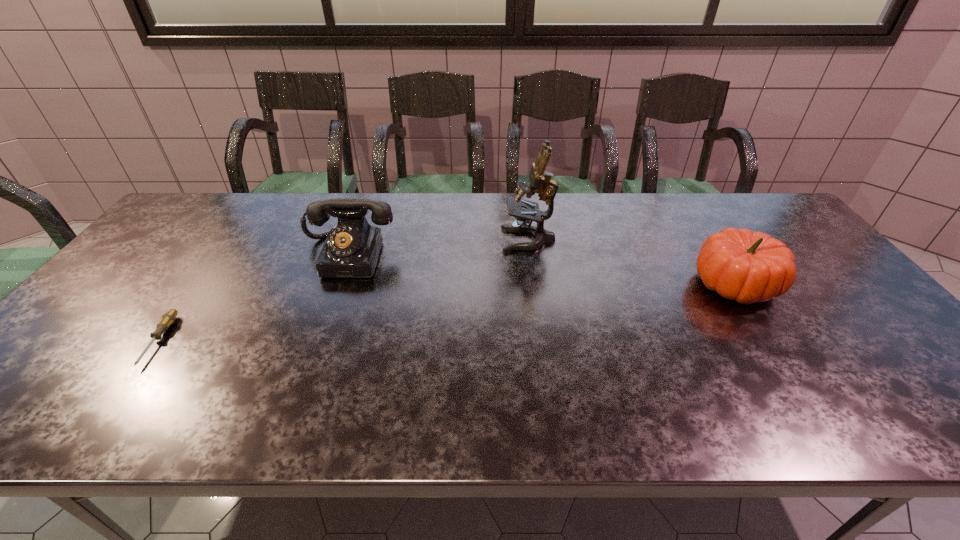
The image size is (960, 540). Identify the location of vacant space located on the left of the rightmost object. (623, 284).

This screenshot has height=540, width=960. Identify the location of free space located 0.140m at the tip of the shortest object. (97, 427).

The width and height of the screenshot is (960, 540). Identify the location of object present at the far edge. (541, 182).

This screenshot has width=960, height=540. In the image, there is a desktop. In order to click on vacant space at the far edge in this screenshot , I will do `click(468, 211)`.

In the image, there is a desktop. At what (x,y) coordinates should I click in order to perform the action: click on vacant space at the near edge. Please return your answer as a coordinate pair (x, y). Looking at the image, I should click on (871, 402).

Image resolution: width=960 pixels, height=540 pixels. In the image, there is a desktop. Identify the location of vacant region at the left edge. (84, 386).

The height and width of the screenshot is (540, 960). In the image, there is a desktop. What are the coordinates of `vacant space at the right edge` in the screenshot? It's located at (835, 283).

Identify the location of vacant space at the far left corner of the desktop. (222, 208).

I want to click on free location at the far right corner of the desktop, so click(x=723, y=201).

Find the location of a particular element. This screenshot has height=540, width=960. vacant space in between the tallest object and the telephone is located at coordinates (439, 248).